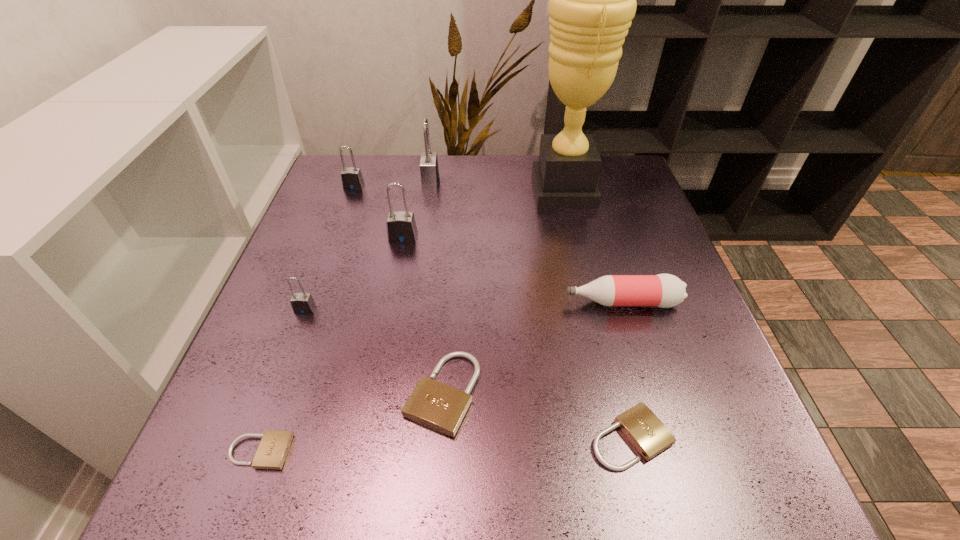
The image size is (960, 540). I want to click on vacant position located on the right of the shortest padlock, so click(x=407, y=451).

Locate an element on the screen. trophy cup that is at the far edge is located at coordinates (592, 0).

Locate an element on the screen. The height and width of the screenshot is (540, 960). trophy cup present at the right edge is located at coordinates (592, 0).

Where is `bottle that is at the right edge`? The height and width of the screenshot is (540, 960). bottle that is at the right edge is located at coordinates (663, 290).

At what (x,y) coordinates should I click in order to perform the action: click on padlock at the right edge. Please return your answer as a coordinate pair (x, y). This screenshot has width=960, height=540. Looking at the image, I should click on (646, 432).

Locate an element on the screen. Image resolution: width=960 pixels, height=540 pixels. object located in the far left corner section of the desktop is located at coordinates (352, 179).

Locate an element on the screen. The width and height of the screenshot is (960, 540). object that is at the near left corner is located at coordinates (272, 451).

You are a GUI agent. You are given a task and a screenshot of the screen. Output one action in this format:
    pyautogui.click(x=<x>, y=<y>)
    Task: Click on the object at the far right corner
    This screenshot has height=540, width=960.
    Given the screenshot: What is the action you would take?
    pyautogui.click(x=592, y=0)

This screenshot has height=540, width=960. What are the coordinates of `object that is positioned at the near right corner` in the screenshot? It's located at (646, 432).

Locate an element on the screen. The image size is (960, 540). vacant space at the far edge is located at coordinates (461, 164).